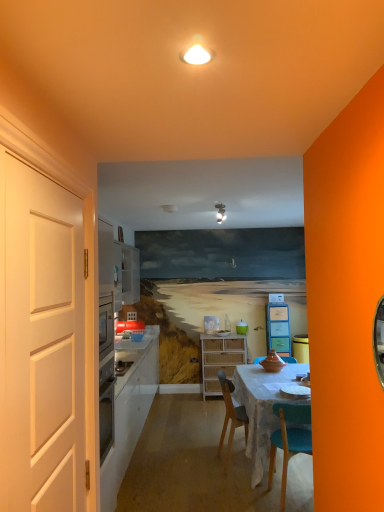
Question: From a real-world perspective, is woven wood cabinet at center, the first cabinetry viewed from the left, on top of white matte door at left?

Choices:
 (A) yes
 (B) no

Answer: (B)

Question: From a real-world perspective, is woven wood cabinet at center, the 2th cabinetry viewed from the right, positioned under white matte door at left based on gravity?

Choices:
 (A) no
 (B) yes

Answer: (B)

Question: Are woven wood cabinet at center, the 2th cabinetry viewed from the right, and white matte door at left making contact?

Choices:
 (A) no
 (B) yes

Answer: (A)

Question: From the image's perspective, is woven wood cabinet at center, the 2th cabinetry viewed from the right, above white matte door at left?

Choices:
 (A) yes
 (B) no

Answer: (B)

Question: Is woven wood cabinet at center, the 2th cabinetry viewed from the right, further to camera compared to white matte door at left?

Choices:
 (A) yes
 (B) no

Answer: (A)

Question: From the image's perspective, is woven wood cabinet at center, the 2th cabinetry viewed from the right, below white matte door at left?

Choices:
 (A) yes
 (B) no

Answer: (A)

Question: From a real-world perspective, is matte plastic cabinet at center, which is counted as the second cabinetry, starting from the left, positioned under white matte door at left based on gravity?

Choices:
 (A) yes
 (B) no

Answer: (A)

Question: Is matte plastic cabinet at center, which is counted as the second cabinetry, starting from the left, facing towards white matte door at left?

Choices:
 (A) yes
 (B) no

Answer: (B)

Question: From the image's perspective, does matte plastic cabinet at center, which is the 1th cabinetry in right-to-left order, appear lower than white matte door at left?

Choices:
 (A) no
 (B) yes

Answer: (B)

Question: Is matte plastic cabinet at center, which is counted as the second cabinetry, starting from the left, facing away from white matte door at left?

Choices:
 (A) yes
 (B) no

Answer: (B)

Question: Are matte plastic cabinet at center, which is counted as the second cabinetry, starting from the left, and white matte door at left beside each other?

Choices:
 (A) no
 (B) yes

Answer: (A)

Question: Does matte plastic cabinet at center, which is counted as the second cabinetry, starting from the left, appear on the left side of white matte door at left?

Choices:
 (A) yes
 (B) no

Answer: (B)

Question: Considering the relative positions of matte white light fixture at upper center and white matte door at left in the image provided, is matte white light fixture at upper center to the right of white matte door at left from the viewer's perspective?

Choices:
 (A) yes
 (B) no

Answer: (A)